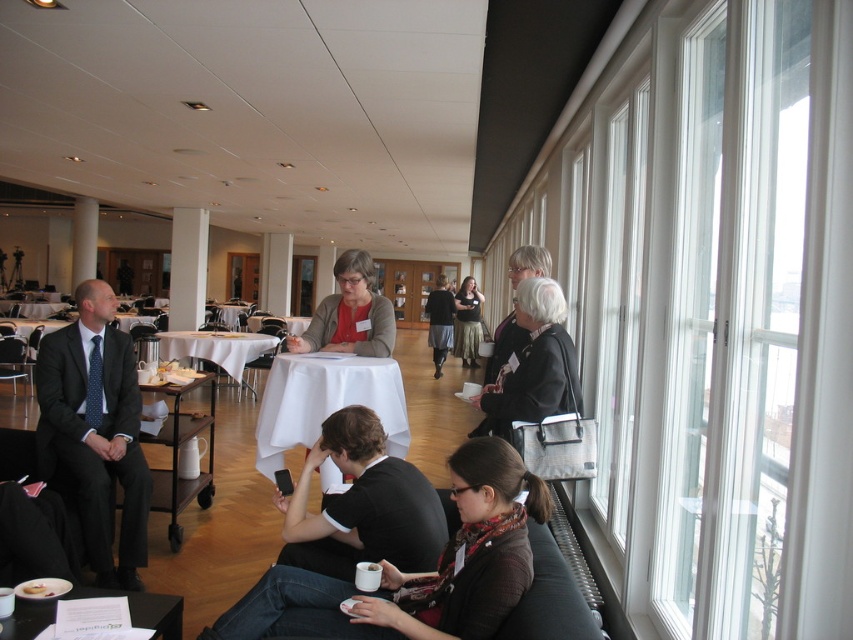
Question: Is white cloth-covered table at center smaller than matte black shirt at center?

Choices:
 (A) yes
 (B) no

Answer: (B)

Question: Does white cloth table at center appear under matte brown cookie at lower left?

Choices:
 (A) no
 (B) yes

Answer: (A)

Question: Is dark gray suit at left to the left of dark gray shirt at center from the viewer's perspective?

Choices:
 (A) no
 (B) yes

Answer: (B)

Question: Considering the real-world distances, which object is closest to the matte black jacket at center?

Choices:
 (A) white cloth-covered table at center
 (B) dark gray shirt at center
 (C) wooden cart at center

Answer: (B)

Question: Which point is closer to the camera?

Choices:
 (A) (439, 326)
 (B) (212, 364)
 (C) (184, 497)

Answer: (C)

Question: Among these points, which one is farthest from the camera?

Choices:
 (A) (271, 397)
 (B) (473, 316)
 (C) (105, 593)

Answer: (B)